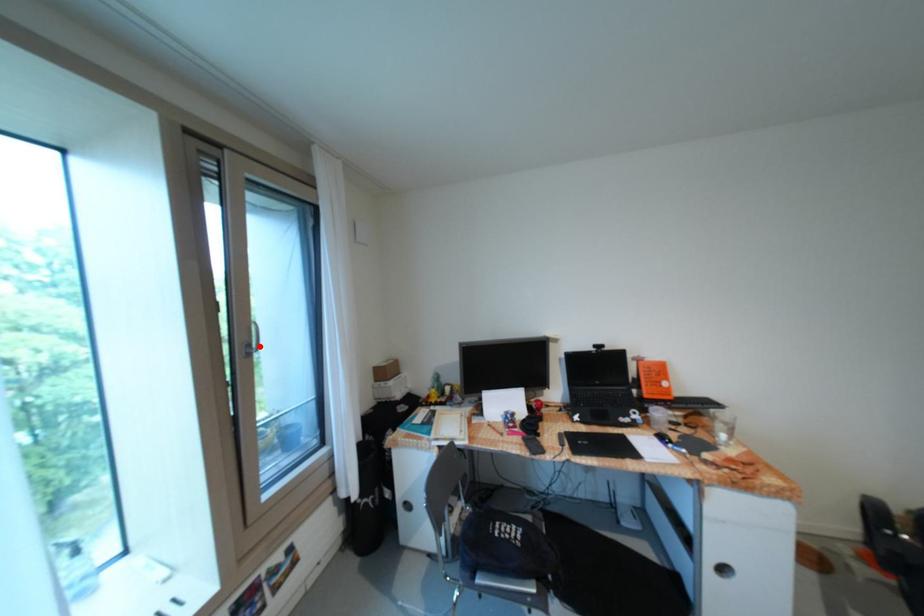
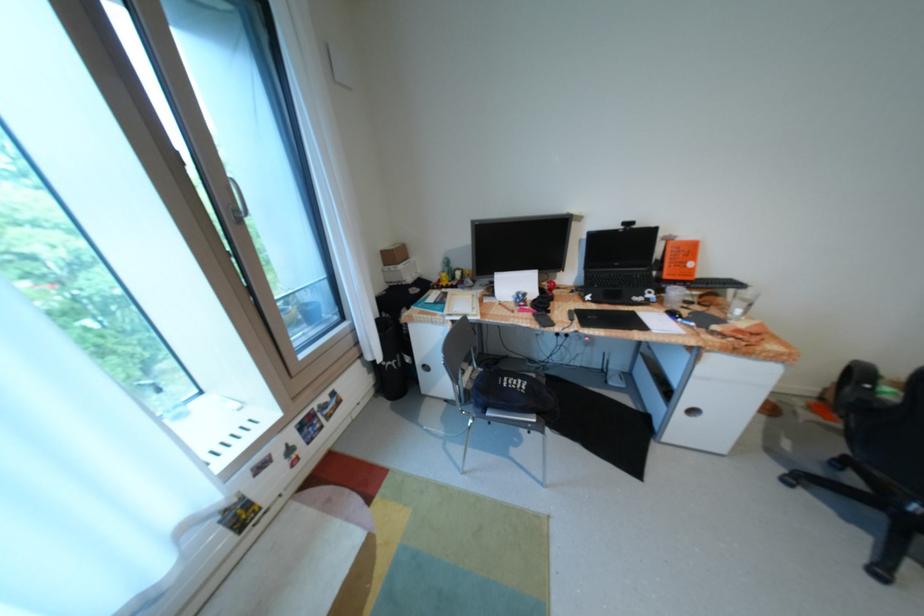
Where in the second image is the point corresponding to the highlighted location from the first image?

(247, 211)